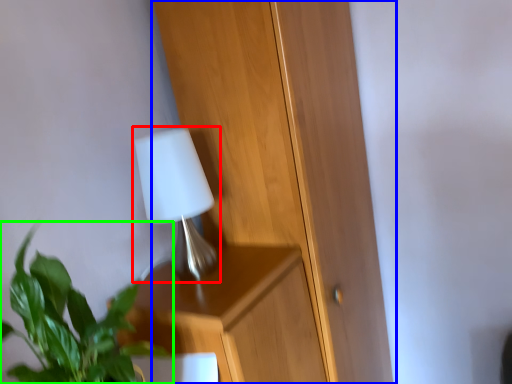
Question: Which object is positioned closest to lamp (highlighted by a red box)? Select from dresser (highlighted by a blue box) and houseplant (highlighted by a green box).

Choices:
 (A) dresser
 (B) houseplant

Answer: (A)